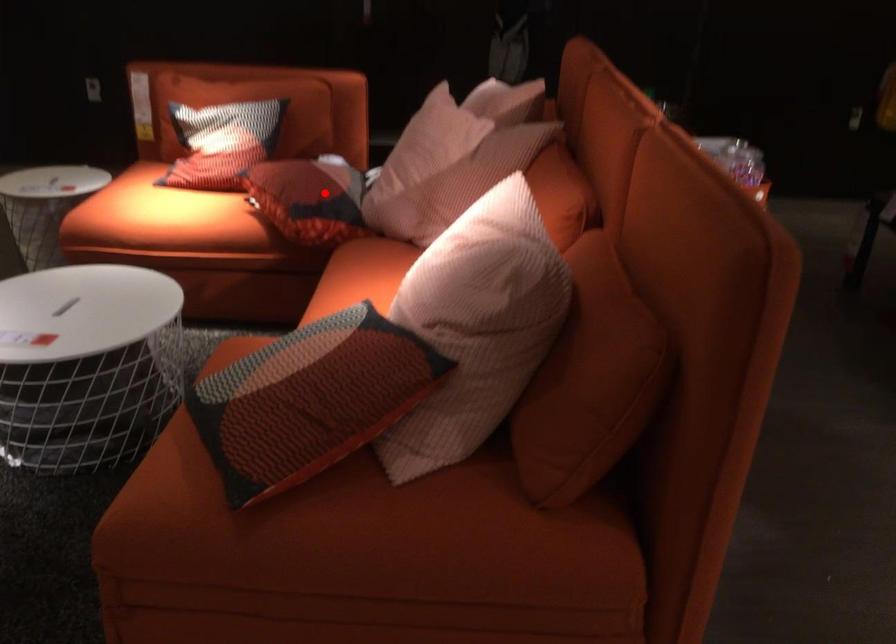
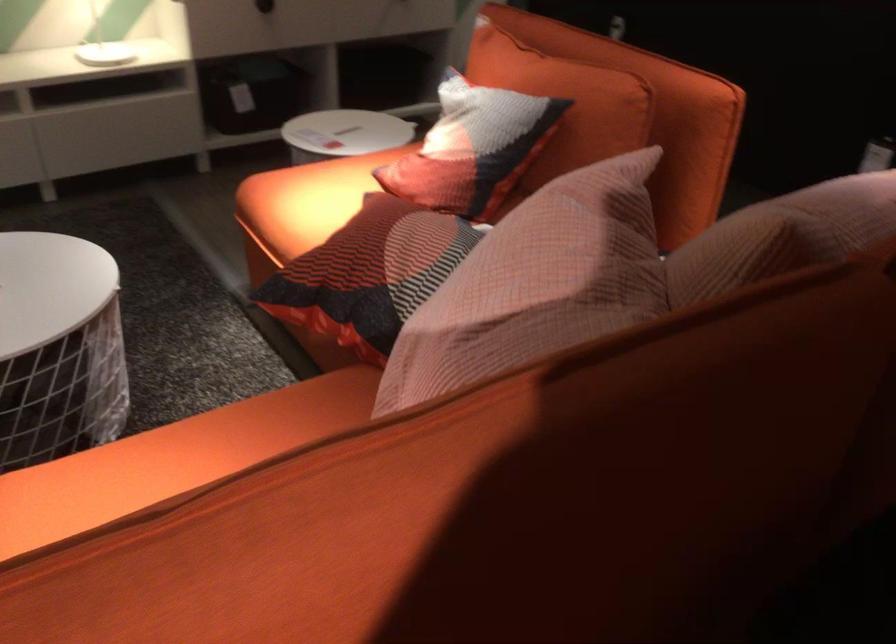
Where in the second image is the point corresponding to the highlighted location from the first image?

(369, 274)